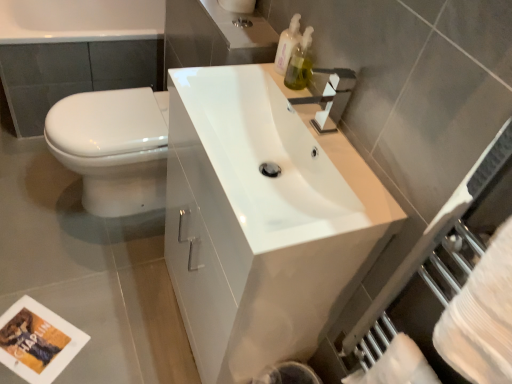
Question: Considering the positions of white glossy sink at center and white glossy bathtub at upper left in the image, is white glossy sink at center wider or thinner than white glossy bathtub at upper left?

Choices:
 (A) wide
 (B) thin

Answer: (B)

Question: From the image's perspective, is white glossy sink at center above or below white glossy bathtub at upper left?

Choices:
 (A) above
 (B) below

Answer: (B)

Question: Estimate the real-world distances between objects in this image. Which object is farther from the white glossy toilet at left?

Choices:
 (A) translucent plastic soap dispenser at upper right, the 2th soap dispenser from the bottom
 (B) white paper towel at lower right, which is the first toilet paper in right-to-left order
 (C) white glossy sink at center
 (D) matte silver faucet at upper center
 (E) white glossy bathtub at upper left

Answer: (B)

Question: Estimate the real-world distances between objects in this image. Which object is farther from the matte silver faucet at upper center?

Choices:
 (A) white glossy bathtub at upper left
 (B) white matte toilet paper at upper center, arranged as the second toilet paper when ordered from the bottom
 (C) white glossy sink at center
 (D) white paper towel at lower right, the second toilet paper viewed from the left
 (E) translucent plastic soap dispenser at upper right, which appears as the 2th soap dispenser when viewed from the top

Answer: (A)